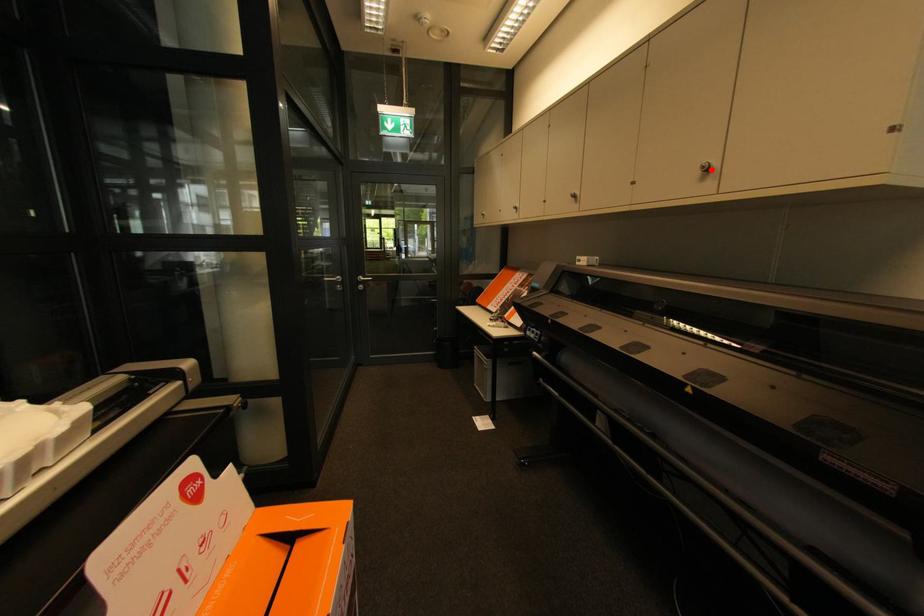
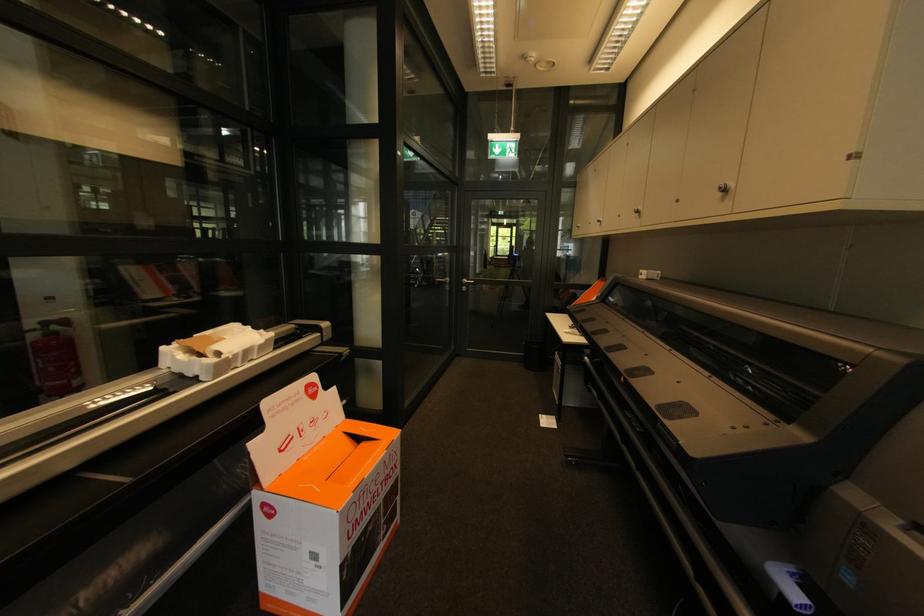
Find the pixel in the second image that matches the highlighted location in the first image.

(727, 191)